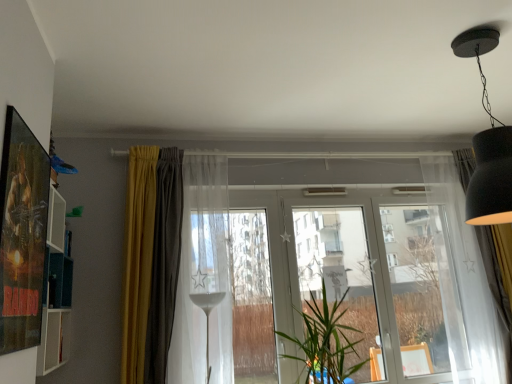
Question: Considering the positions of transparent glass window frame at center and transparent glass wine glass at center in the image, is transparent glass window frame at center bigger or smaller than transparent glass wine glass at center?

Choices:
 (A) small
 (B) big

Answer: (B)

Question: From their relative heights in the image, would you say transparent glass window frame at center is taller or shorter than transparent glass wine glass at center?

Choices:
 (A) tall
 (B) short

Answer: (A)

Question: Estimate the real-world distances between objects in this image. Which object is closer to the green leafy plant at center?

Choices:
 (A) yellow fabric curtain at left, placed as the 3th curtain when sorted from right to left
 (B) transparent glass window at center
 (C) transparent glass screen door at center, the second screen door in the left-to-right sequence
 (D) transparent glass screen door at center, the 2th screen door when ordered from right to left
 (E) matte black lampshade at upper right

Answer: (D)

Question: Considering the real-world distances, which object is closest to the green leafy plant at center?

Choices:
 (A) transparent glass window at center
 (B) white sheer curtain at right, positioned as the 3th curtain in left-to-right order
 (C) matte black lampshade at upper right
 (D) metallic poster at left
 (E) transparent glass screen door at center, positioned as the first screen door in right-to-left order

Answer: (A)